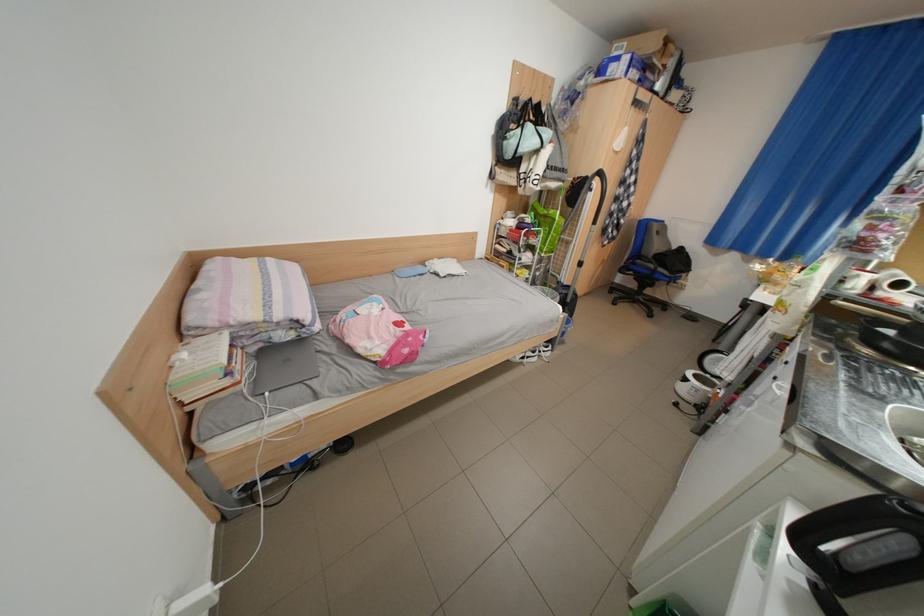
Image resolution: width=924 pixels, height=616 pixels. I want to click on wardrobe door handle, so click(x=781, y=383).